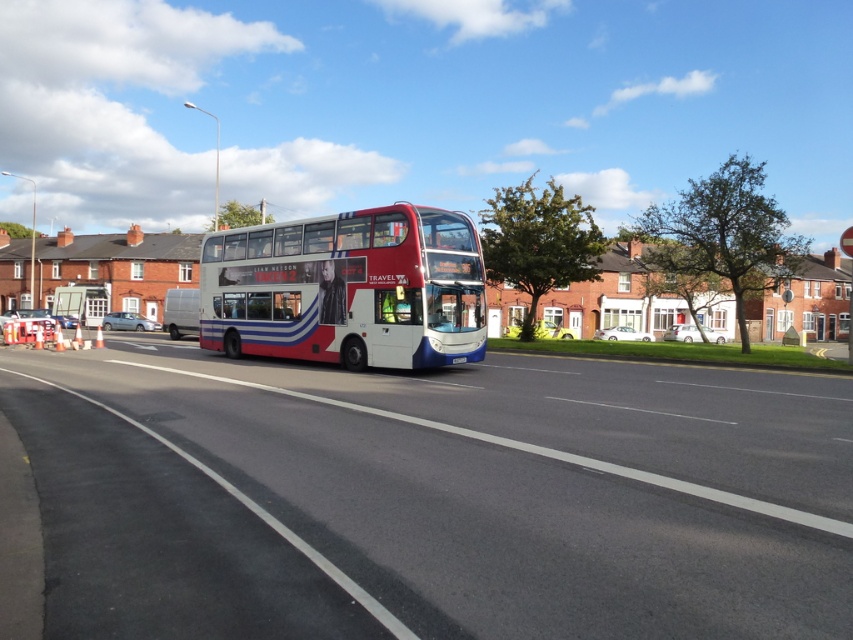
Based on the photo, who is more forward, (271, 273) or (461, 362)?

Point (461, 362) is in front.

Does point (309, 333) come behind point (463, 356)?

Yes, point (309, 333) is behind point (463, 356).

Find the location of a particular element. The height and width of the screenshot is (640, 853). white glossy decker bus at center is located at coordinates (347, 289).